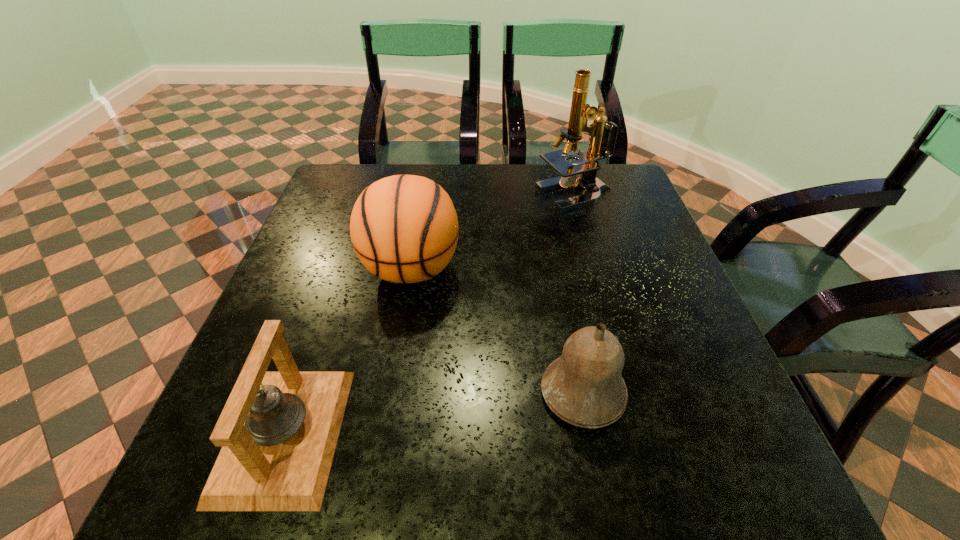
Where is `free point between the third nearest object and the microscope`? Image resolution: width=960 pixels, height=540 pixels. free point between the third nearest object and the microscope is located at coordinates click(x=492, y=233).

The image size is (960, 540). I want to click on unoccupied position between the right bell and the left bell, so click(x=434, y=413).

Locate an element on the screen. empty location between the microscope and the right bell is located at coordinates (579, 295).

Identify which object is located as the third nearest to the right bell. Please provide its 2D coordinates. Your answer should be formatted as a tuple, i.e. [(x, y)], where the tuple contains the x and y coordinates of a point satisfying the conditions above.

[(591, 187)]

Where is `object that can be found as the second closest to the left bell`? The width and height of the screenshot is (960, 540). object that can be found as the second closest to the left bell is located at coordinates (584, 387).

This screenshot has height=540, width=960. Find the location of `vacant area that satisfies the following two spatial constraints: 1. at the eyepiece of the microscope; 2. on the front side of the left bell`. vacant area that satisfies the following two spatial constraints: 1. at the eyepiece of the microscope; 2. on the front side of the left bell is located at coordinates (642, 434).